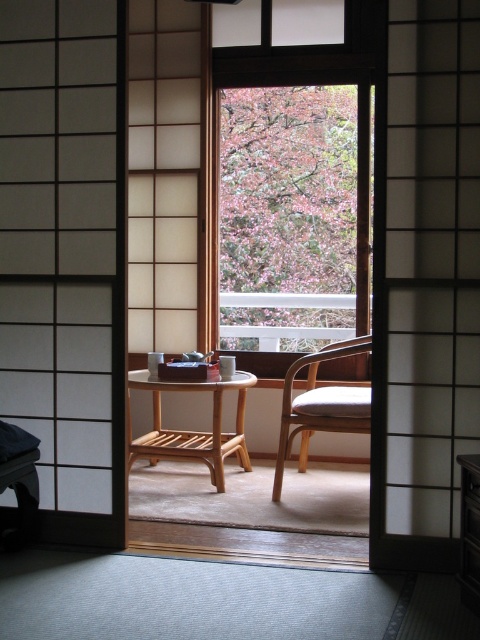
Question: Which point is closer to the camera?

Choices:
 (A) (319, 419)
 (B) (222, 461)

Answer: (A)

Question: Among these points, which one is nearest to the camera?

Choices:
 (A) (284, 380)
 (B) (219, 442)

Answer: (B)

Question: Which is nearer to the wooden chair at center?

Choices:
 (A) light brown wooden table at center
 (B) transparent glass window at center

Answer: (A)

Question: Does transparent glass window at center appear over wooden chair at center?

Choices:
 (A) yes
 (B) no

Answer: (A)

Question: Does transparent glass window at center appear over wooden chair at center?

Choices:
 (A) no
 (B) yes

Answer: (B)

Question: From the image, what is the correct spatial relationship of transparent glass window at center in relation to wooden chair at center?

Choices:
 (A) above
 (B) below

Answer: (A)